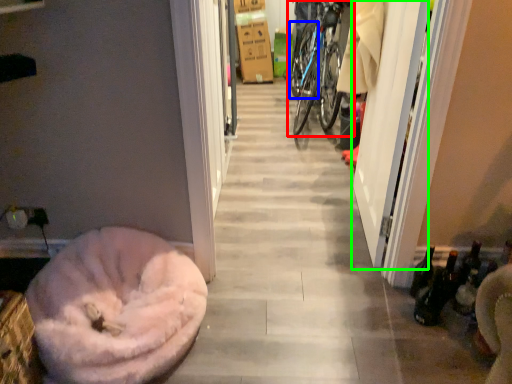
Question: Which object is the closest to the bicycle (highlighted by a red box)? Choose among these: tire (highlighted by a blue box) or screen door (highlighted by a green box).

Choices:
 (A) tire
 (B) screen door

Answer: (A)